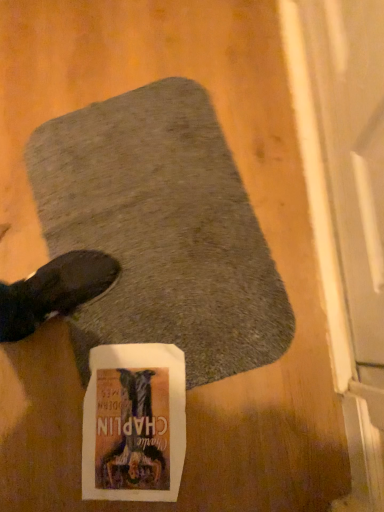
The width and height of the screenshot is (384, 512). Identify the location of blank space above white paper flyer at center (from a real-world perspective). (134, 428).